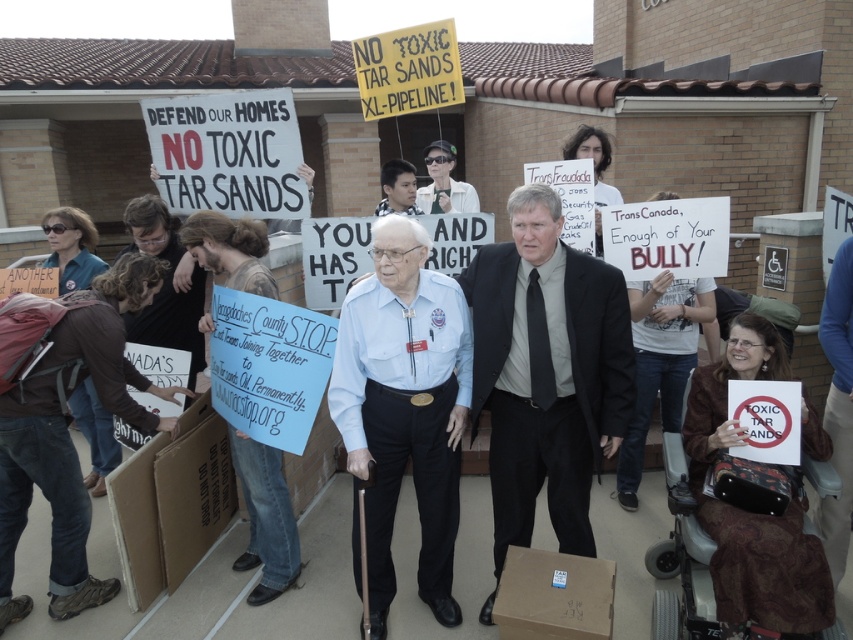
You are a photographer at the protest scene. You want to take a photo that includes both the black suit at center and the brown cardboard box at lower center. Which object should you focus on first to ensure both are in clear focus?

The black suit at center is further to the viewer than the brown cardboard box at lower center. To ensure both are in clear focus, you should focus on the black suit at center first, as it is closer to the camera, and the depth of field will extend to the brown cardboard box at lower center.

Based on the scene description, where is the light blue uniform at center located in terms of coordinates?

The light blue uniform at center is located at coordinates point (404, 406).

You are a photographer at the protest scene. You want to take a photo that includes both the light blue uniform at center and the brown cardboard box at lower left. Which object should you focus on first to ensure both are in frame?

The light blue uniform at center is taller than the brown cardboard box at lower left, so you should focus on the light blue uniform at center first to ensure both fit within the frame.